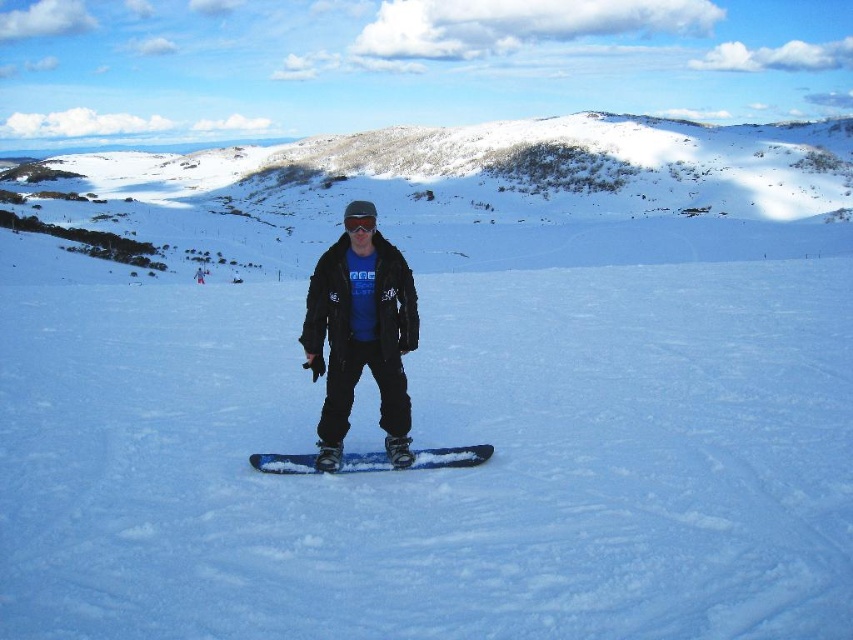
You are planning to go snowboarding and see the point at coordinates [519,168] in the image. Is this point on a snowy mountain or a flat area?

The point at coordinates [519,168] is on a snowy mountain at upper center, so it is on a snowy mountain.